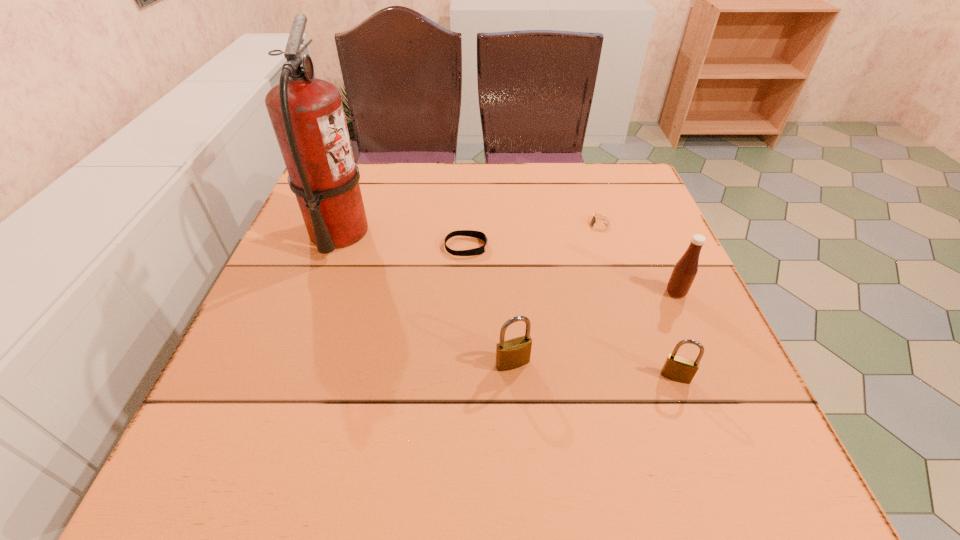
At what (x,y) coordinates should I click in order to perform the action: click on object at the left edge. Please return your answer as a coordinate pair (x, y). The height and width of the screenshot is (540, 960). Looking at the image, I should click on coord(307,115).

Find the location of a particular element. This screenshot has width=960, height=540. padlock that is at the right edge is located at coordinates (677, 368).

Identify the location of Tabasco sauce present at the right edge. (685, 270).

At what (x,y) coordinates should I click in order to perform the action: click on watch that is at the right edge. Please return your answer as a coordinate pair (x, y). This screenshot has width=960, height=540. Looking at the image, I should click on (597, 225).

Find the location of a particular element. This screenshot has height=540, width=960. object that is positioned at the far left corner is located at coordinates (307, 115).

The height and width of the screenshot is (540, 960). What are the coordinates of `object that is at the near right corner` in the screenshot? It's located at (677, 368).

Locate an element on the screen. vacant space at the far edge is located at coordinates (434, 174).

Find the location of a particular element. This screenshot has width=960, height=540. vacant area at the near edge of the desktop is located at coordinates (588, 397).

Where is `vacant space at the left edge of the desktop`? vacant space at the left edge of the desktop is located at coordinates (302, 349).

Where is `vacant area at the right edge of the desktop`? vacant area at the right edge of the desktop is located at coordinates (658, 356).